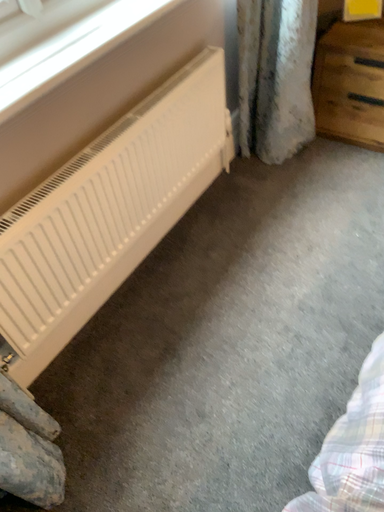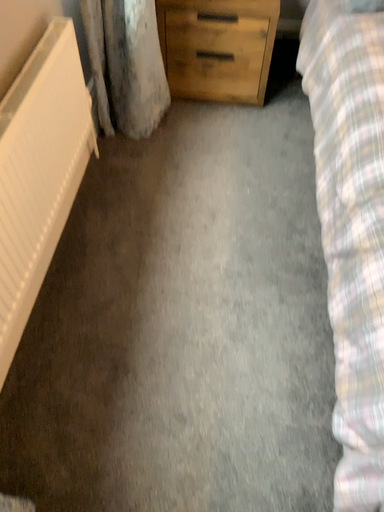
Question: How did the camera likely rotate when shooting the video?

Choices:
 (A) rotated left
 (B) rotated right

Answer: (B)